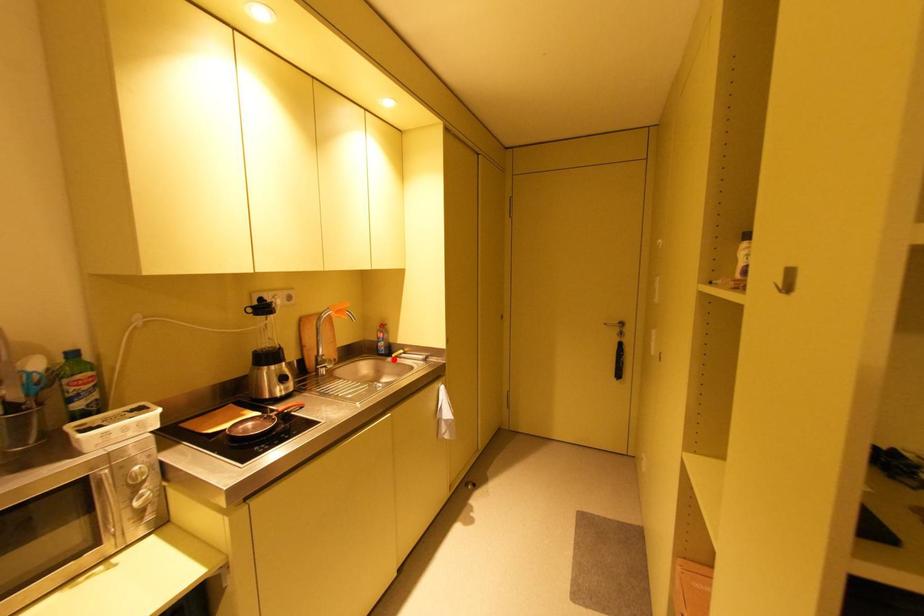
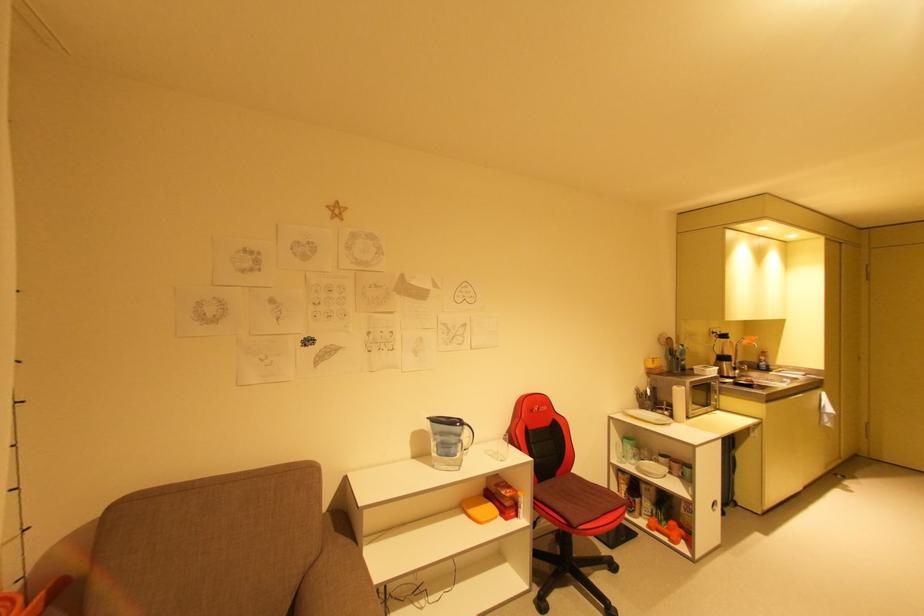
The point at the highlighted location is marked in the first image. Where is the corresponding point in the second image?

(776, 373)